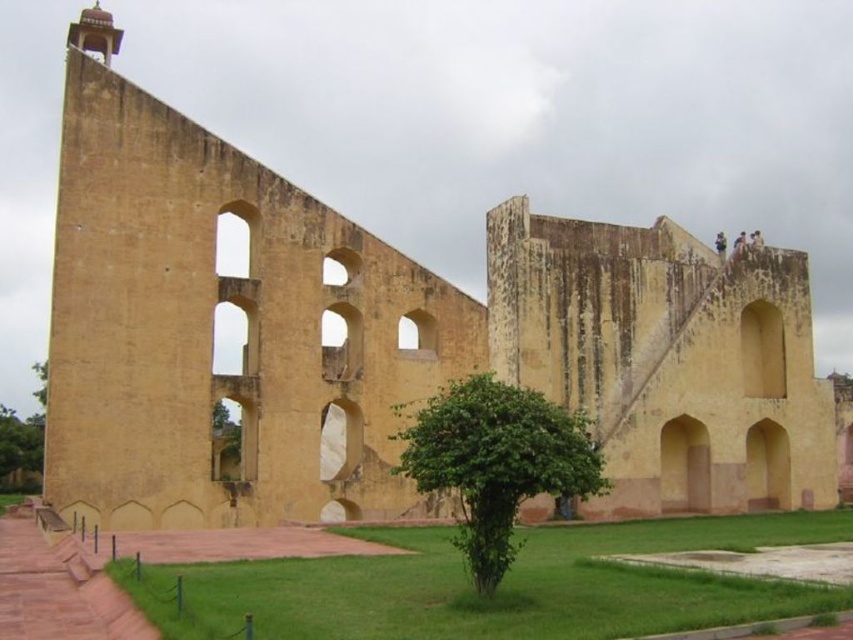
You are a gardener planning to water both the green leafy tree at center and the green leafy tree at lower left. Given that your watering can holds enough water for 10 meters of travel, how many times will you need to refill it to water both trees starting from the building?

The distance between the green leafy tree at center and the green leafy tree at lower left is 73.61 meters. To water both trees, you would need to travel a total distance of 73.61 meters. Since your watering can holds enough water for 10 meters of travel, you would need to refill it 8 times to cover the entire distance.

You are a landscape architect planning to install a new bench in the grassy area. You want to place it between the green leafy tree at center and the green leafy tree at lower left. Which tree should the bench be closer to if you want it to be equidistant from both trees?

The bench should be placed closer to the green leafy tree at center because it has a lesser width compared to the green leafy tree at lower left, so the distance between them can be balanced by positioning the bench nearer to the narrower tree.